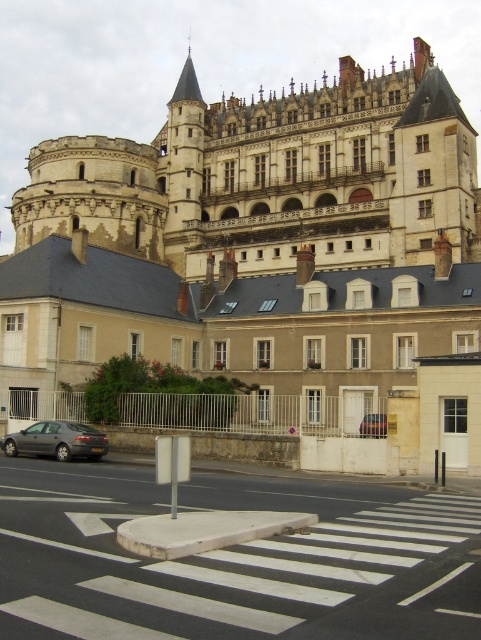
Question: Estimate the real-world distances between objects in this image. Which object is closer to the metallic silver car at center?

Choices:
 (A) dark gray metallic car at lower left
 (B) white asphalt crosswalk at center

Answer: (A)

Question: Which of these objects is positioned farthest from the stone castle at upper center?

Choices:
 (A) metallic silver car at center
 (B) white asphalt crosswalk at center

Answer: (B)

Question: Which of the following is the closest to the observer?

Choices:
 (A) (383, 413)
 (B) (437, 115)

Answer: (A)

Question: Is stone castle at upper center thinner than metallic silver car at center?

Choices:
 (A) yes
 (B) no

Answer: (B)

Question: Can you confirm if stone castle at upper center is positioned above dark gray metallic car at lower left?

Choices:
 (A) yes
 (B) no

Answer: (A)

Question: Does stone castle at upper center have a lesser width compared to white asphalt crosswalk at center?

Choices:
 (A) no
 (B) yes

Answer: (A)